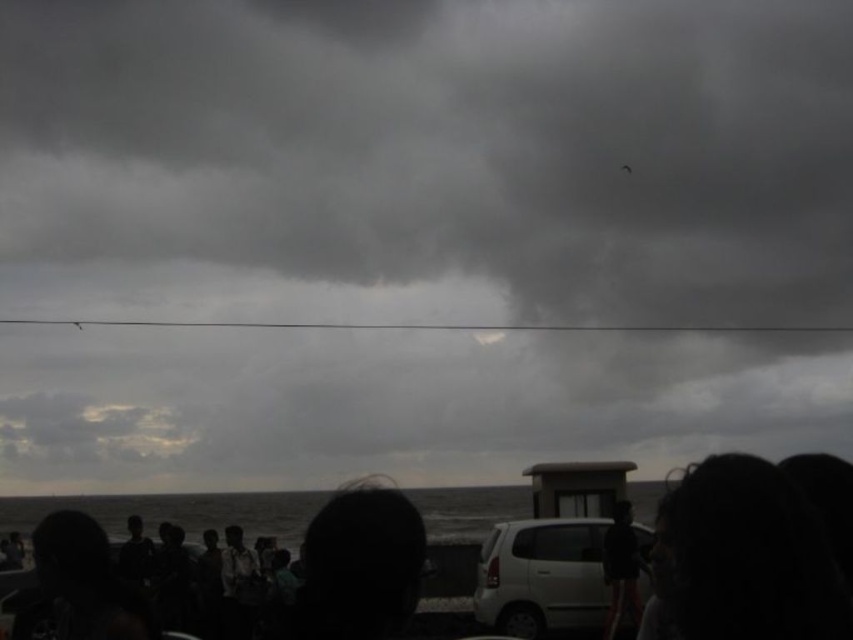
You are a photographer trying to capture the scene. You notice the dark hair at lower right and the black matte crowd at lower center. Which of these two objects is closer to the camera based on their height in the image?

The dark hair at lower right is shorter than the black matte crowd at lower center, so the dark hair at lower right is closer to the camera because objects closer to the camera appear smaller in height.

In the image, there is a dark hair at lower right represented by point (741, 557). Where is this point located relative to the center of the image?

The point (741, 557) is located at the lower right of the image, where the dark hair is situated.

You are a photographer trying to capture the scene with your camera. You notice the dark hair at lower right and the white matte car at center. Which object should you zoom in on to fill the frame more effectively?

The white matte car at center should be zoomed in on because it is larger than the dark hair at lower right, allowing it to fill the frame more effectively.